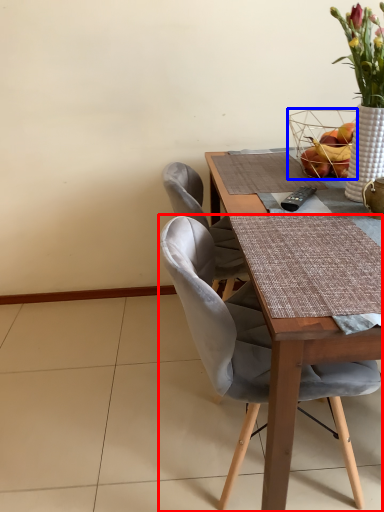
Question: Among these objects, which one is nearest to the camera, chair (highlighted by a red box) or basket (highlighted by a blue box)?

Choices:
 (A) chair
 (B) basket

Answer: (A)